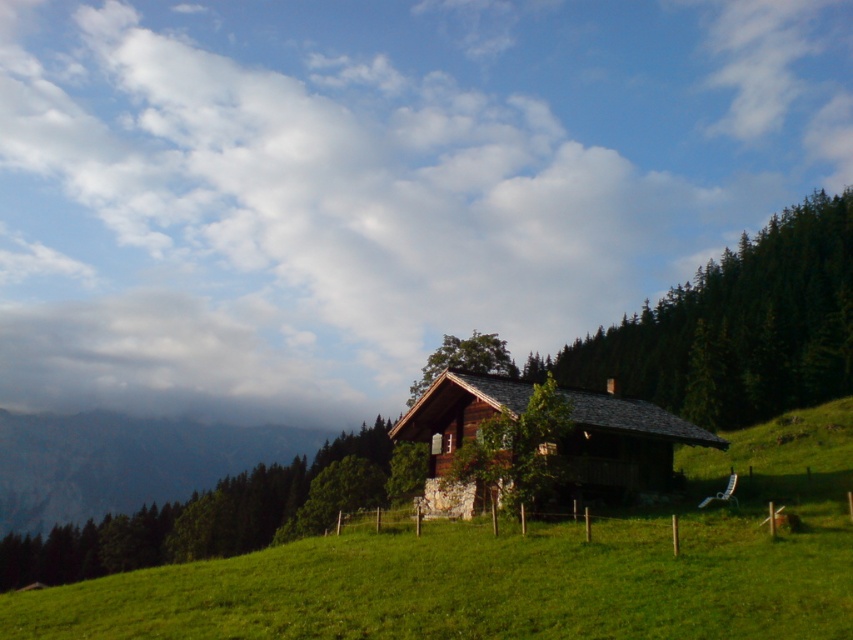
Looking at this image, you are planning to build a small garden shed in the green grassy field at center near the wooden log cabin at center. Considering their sizes, which one is taller?

The wooden log cabin at center is taller than the green grassy field at center.

You are planning to take a photo of the white fluffy cloud at upper center and the green grassy field at center. Which object will have a wider appearance in the photo?

The white fluffy cloud at upper center has a greater width than the green grassy field at center, so it will appear wider in the photo.

You are an architect designing a new cabin and want to ensure it fits within the meadow. Given the scene, does the white fluffy cloud at upper center appear wider than the wooden log cabin at center?

The white fluffy cloud at upper center is wider than the wooden log cabin at center, so yes, it appears wider in the scene.